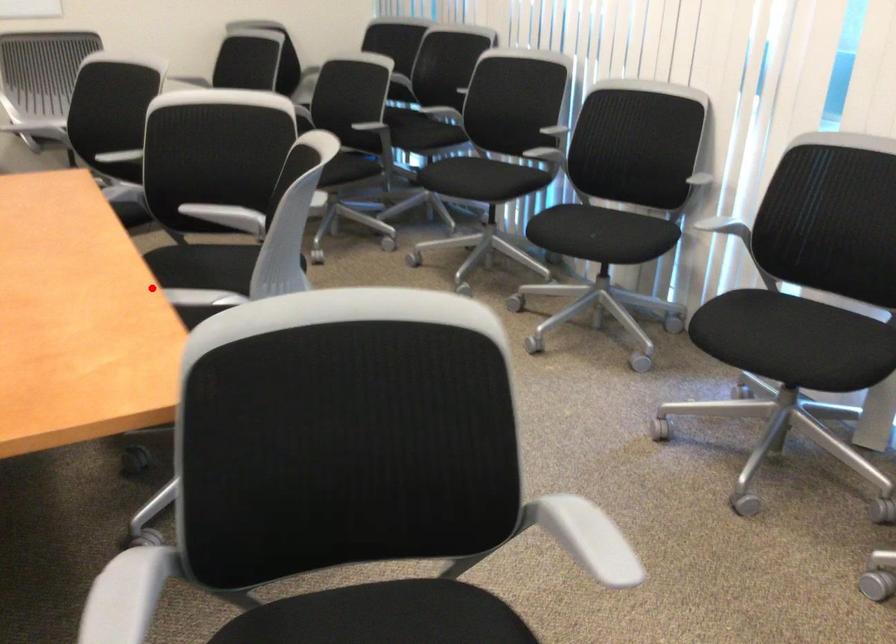
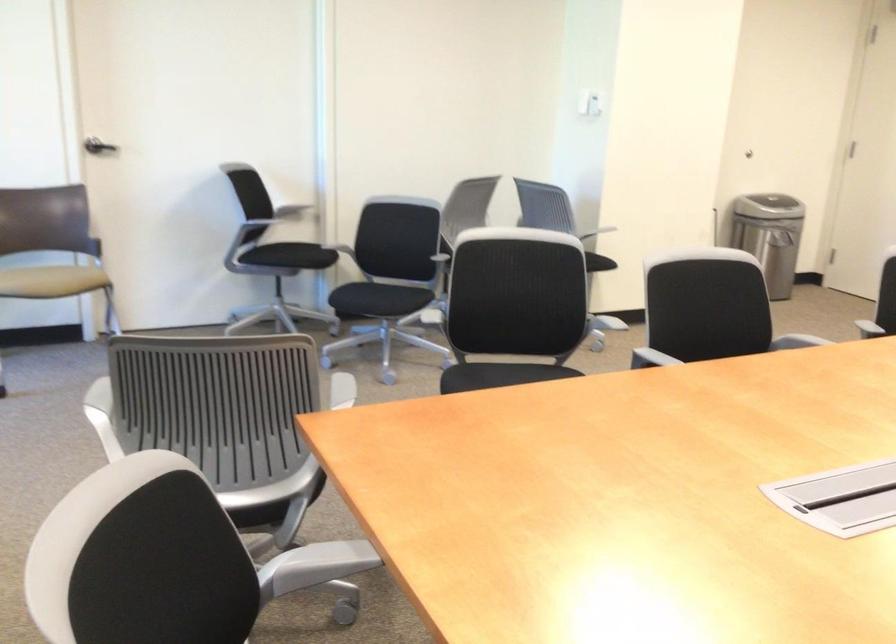
Find the pixel in the second image that matches the highlighted location in the first image.

(320, 562)